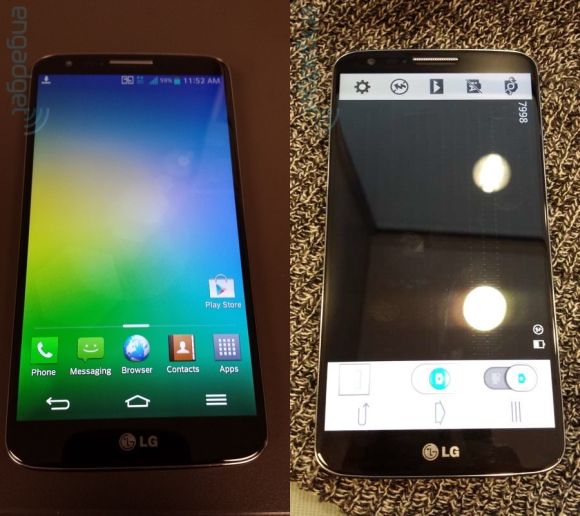
Where is `reflection of ceiling lights`? reflection of ceiling lights is located at coordinates (494, 309), (491, 176).